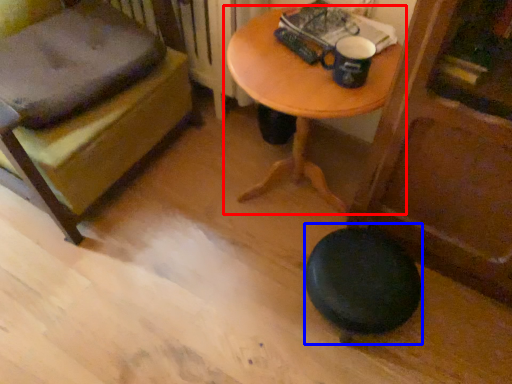
Question: Which point is further to the camera, table (highlighted by a red box) or stool (highlighted by a blue box)?

Choices:
 (A) table
 (B) stool

Answer: (B)